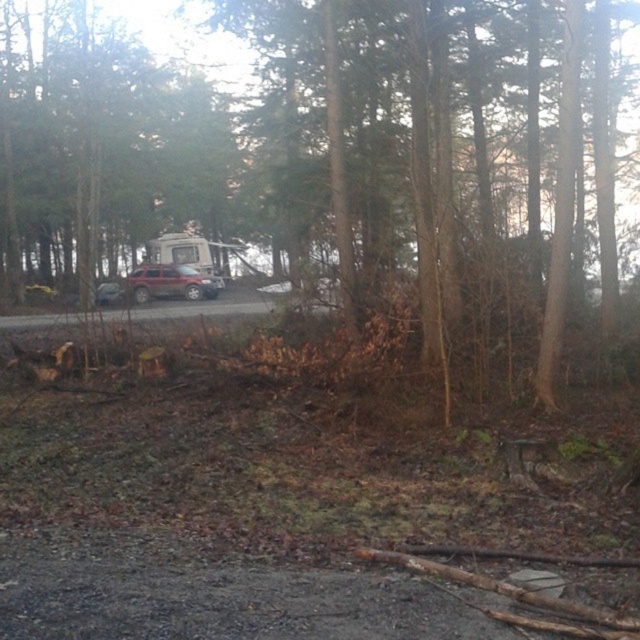
Which of these two, white glossy recreational vehicle at center or satin silver suv at center, stands taller?

white glossy recreational vehicle at center is taller.

Where is `white glossy recreational vehicle at center`? white glossy recreational vehicle at center is located at coordinates (180, 252).

Does point (170, 253) lie behind point (113, 300)?

That is True.

Where is `white glossy recreational vehicle at center`? white glossy recreational vehicle at center is located at coordinates (180, 252).

Can you confirm if rustic metallic jeep at center is positioned above satin silver suv at center?

Yes, rustic metallic jeep at center is above satin silver suv at center.

Who is higher up, rustic metallic jeep at center or satin silver suv at center?

Positioned higher is rustic metallic jeep at center.

Is point (212, 296) closer to viewer compared to point (100, 296)?

That is False.

Locate an element on the screen. The height and width of the screenshot is (640, 640). rustic metallic jeep at center is located at coordinates (170, 282).

Consider the image. Between rustic metallic jeep at center and white glossy recreational vehicle at center, which one has more height?

white glossy recreational vehicle at center is taller.

Can you confirm if rustic metallic jeep at center is bigger than white glossy recreational vehicle at center?

No.

Does point (172, 296) come behind point (195, 266)?

No, (172, 296) is closer to viewer.

This screenshot has width=640, height=640. Identify the location of rustic metallic jeep at center. coord(170,282).